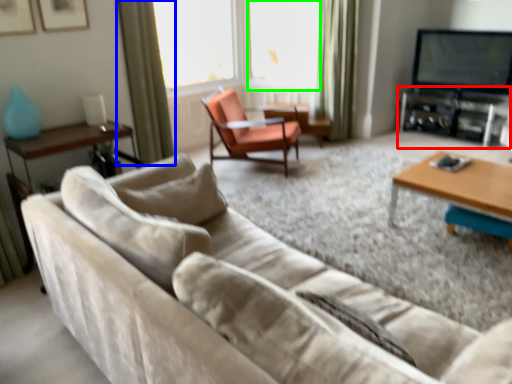
Question: Which object is positioned closest to entertainment center (highlighted by a red box)? Select from curtain (highlighted by a blue box) and window screen (highlighted by a green box).

Choices:
 (A) curtain
 (B) window screen

Answer: (B)